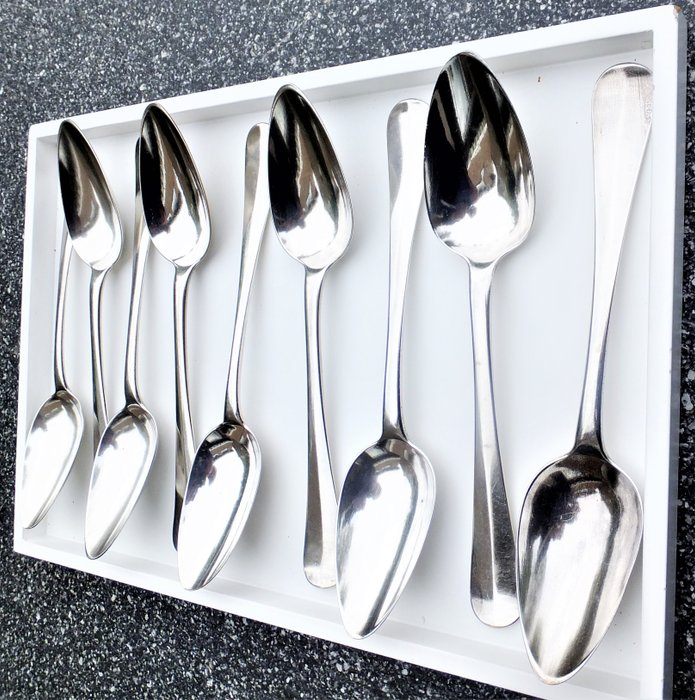
The height and width of the screenshot is (700, 695). I want to click on tablespoons, so click(51, 467), click(105, 472), click(220, 514), click(372, 528), click(553, 550), click(490, 176), click(320, 197), click(169, 195), click(80, 190).